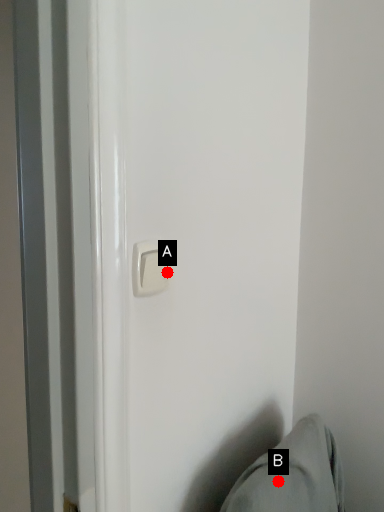
Question: Two points are circled on the image, labeled by A and B beside each circle. Among these points, which one is nearest to the camera?

Choices:
 (A) A is closer
 (B) B is closer

Answer: (A)